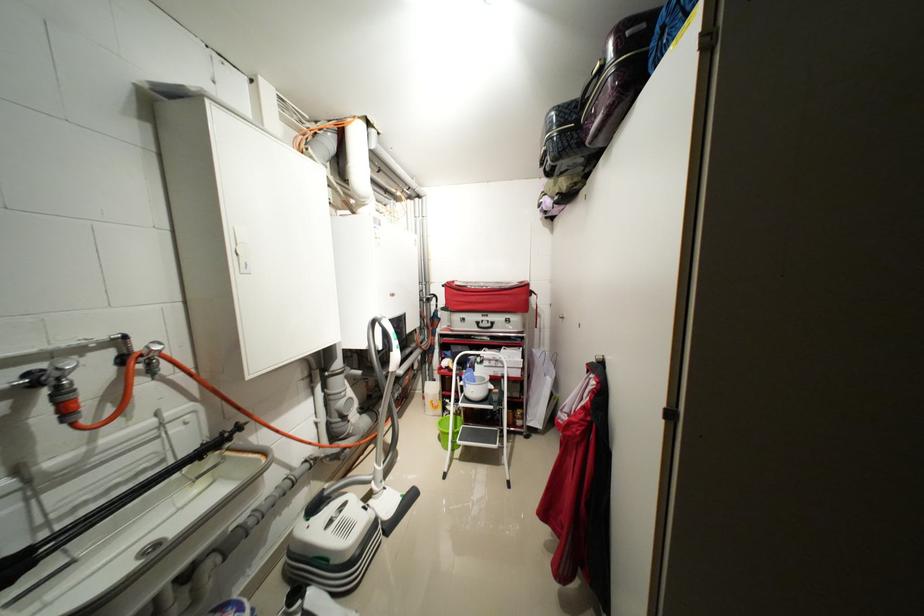
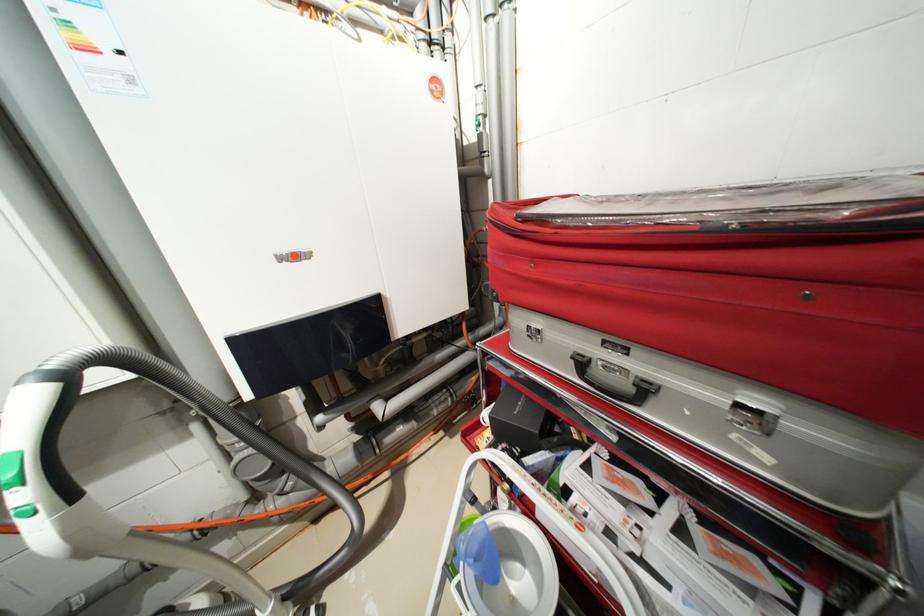
Where in the second image is the point corresponding to the point at 484,323 from the first image?

(589, 363)